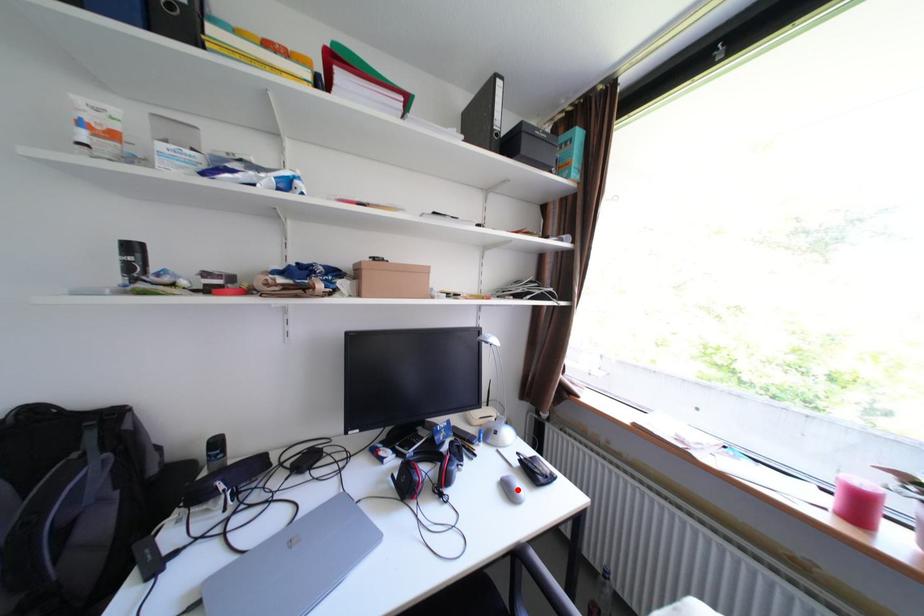
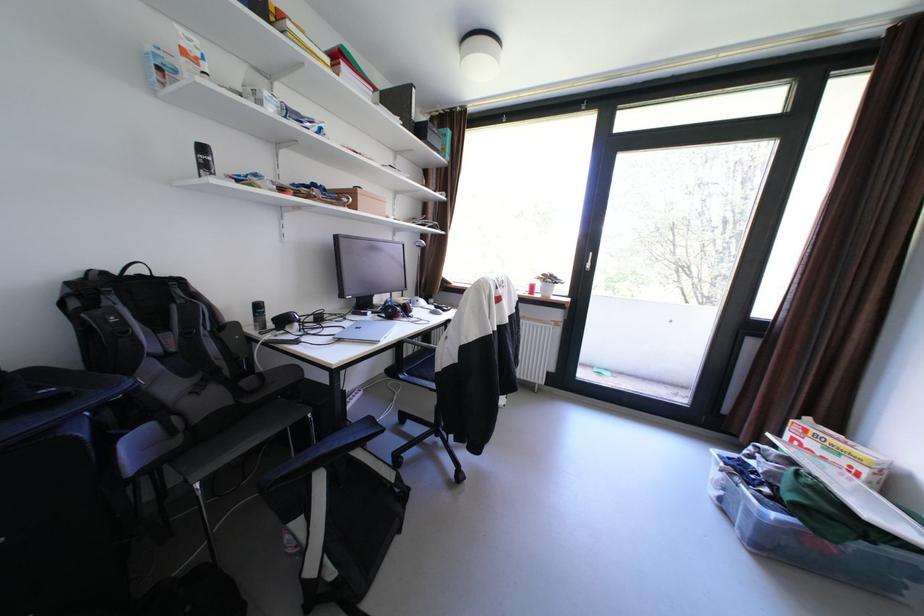
Question: I am providing you with two images of the same scene from different viewpoints. A red point is marked on the first image. Is the red point's position out of view in image 2?

Choices:
 (A) Yes
 (B) No

Answer: (A)